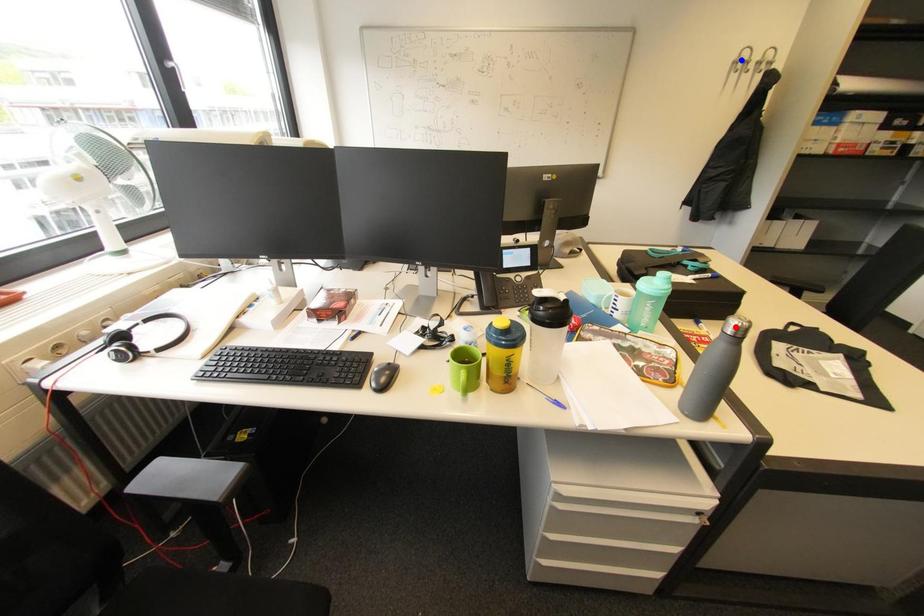
Question: Which of the two points in the image is closer to the camera?

Choices:
 (A) Blue point is closer.
 (B) Red point is closer.

Answer: (B)